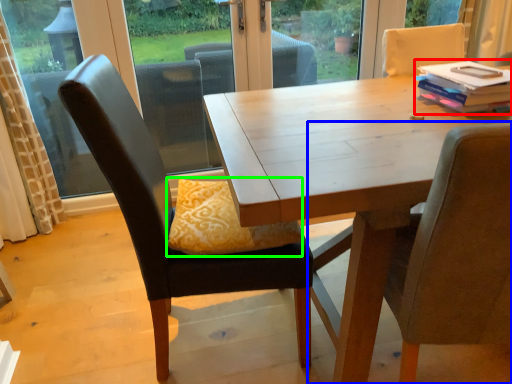
Question: Considering the real-world distances, which object is farthest from book (highlighted by a red box)? chair (highlighted by a blue box) or pillow (highlighted by a green box)?

Choices:
 (A) chair
 (B) pillow

Answer: (B)